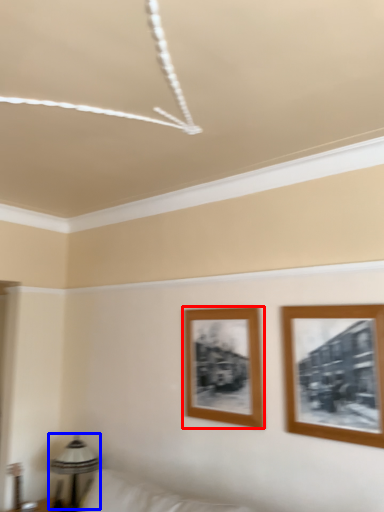
Question: Which object appears closest to the camera in this image, picture frame (highlighted by a red box) or table lamp (highlighted by a blue box)?

Choices:
 (A) picture frame
 (B) table lamp

Answer: (A)